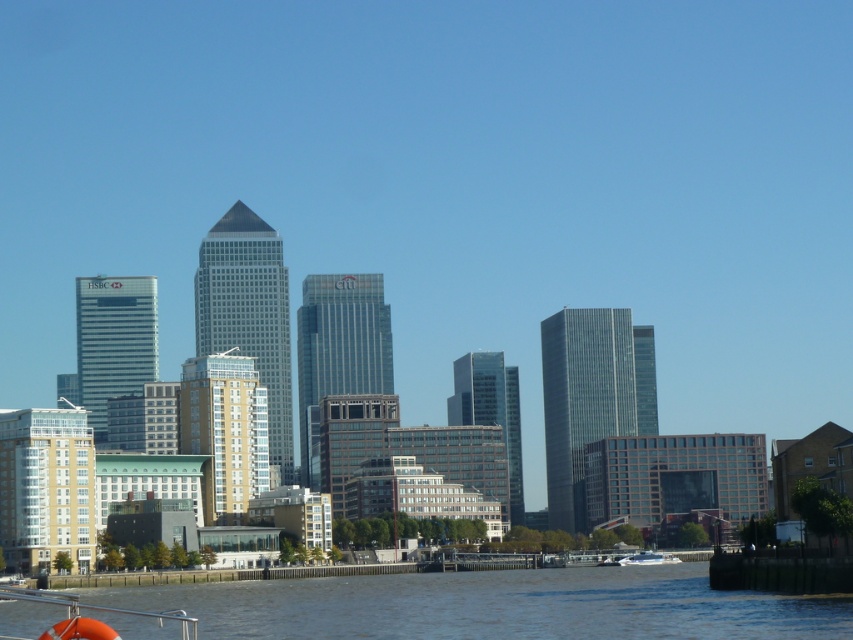
You are standing on the dock and see the brown water at lower center and the white glossy boat at lower center. Which object is positioned to the left when facing the city skyline?

The brown water at lower center is to the left of the white glossy boat at lower center when facing the city skyline.

In the scene shown: You are a tourist standing on the shore looking at the city skyline. You notice the brown water at lower center and the white glossy boat at lower center. Which object is closer to you?

The white glossy boat at lower center is closer to you because it is below the brown water at lower center, which is positioned above it.

You are standing on the boat looking at the city skyline. There are two points marked on the buildings in the scene. The first point is at coordinates point (403, 573) and the second is at point (619, 564). Which of these two points is closer to you?

Point (403, 573) is closer to the camera than point (619, 564).